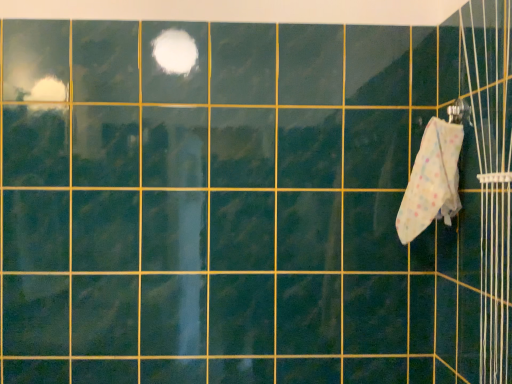
What do you see at coordinates (432, 181) in the screenshot? Image resolution: width=512 pixels, height=384 pixels. I see `white polka dot fabric at right` at bounding box center [432, 181].

At what (x,y) coordinates should I click in order to perform the action: click on white polka dot fabric at right. Please return your answer as a coordinate pair (x, y). Looking at the image, I should click on (432, 181).

In order to face white polka dot fabric at right, should I rotate leftwards or rightwards?

You should rotate right by 21.940 degrees.

Where is `white polka dot fabric at right`? white polka dot fabric at right is located at coordinates (432, 181).